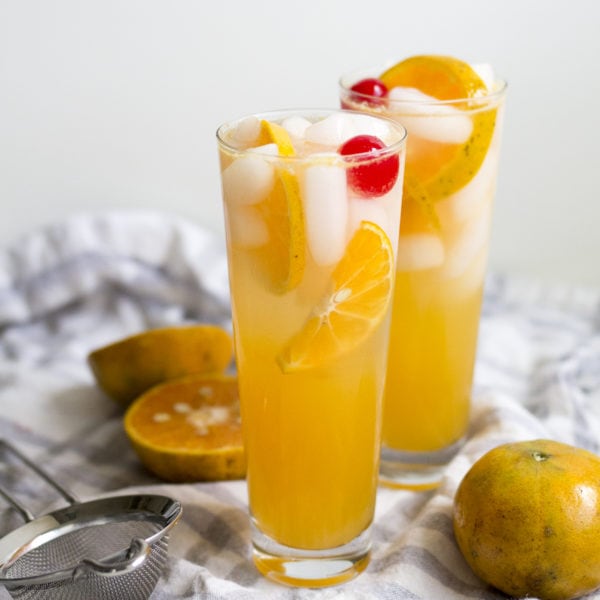
Identify the location of glasses of juice. Image resolution: width=600 pixels, height=600 pixels. (332, 448), (439, 383).